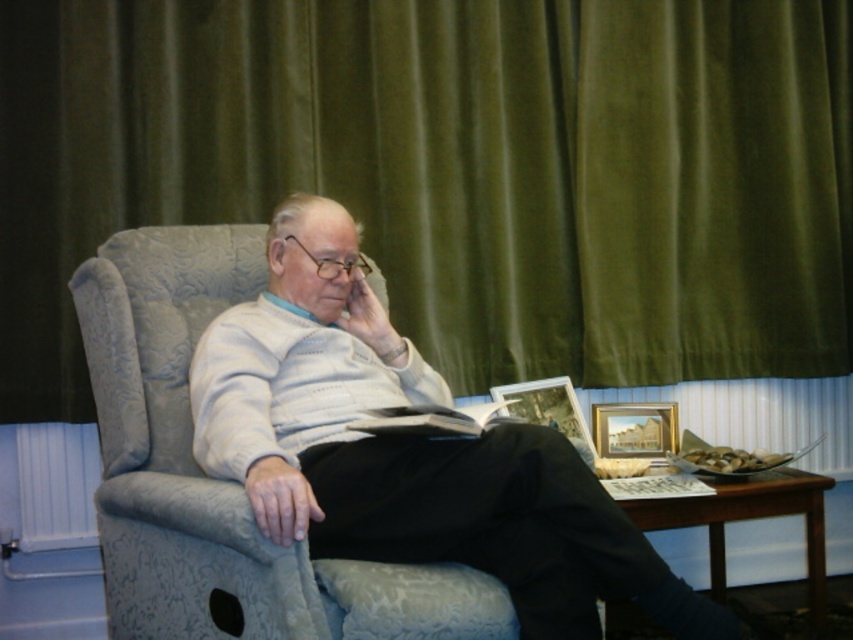
Between velvet green curtain at upper center and gold-framed picture at right, which one has more height?

velvet green curtain at upper center is taller.

Does velvet green curtain at upper center have a greater height compared to gold-framed picture at right?

Indeed, velvet green curtain at upper center has a greater height compared to gold-framed picture at right.

Find the location of a particular element. The height and width of the screenshot is (640, 853). velvet green curtain at upper center is located at coordinates (454, 172).

In order to click on velvet green curtain at upper center in this screenshot , I will do `click(454, 172)`.

Is light gray fabric chair at center shorter than gold-framed picture at right?

Incorrect, light gray fabric chair at center's height does not fall short of gold-framed picture at right's.

Does light gray fabric chair at center have a greater width compared to gold-framed picture at right?

Yes, light gray fabric chair at center is wider than gold-framed picture at right.

Where is `light gray fabric chair at center`? The image size is (853, 640). light gray fabric chair at center is located at coordinates (405, 451).

What do you see at coordinates (635, 429) in the screenshot? I see `gold-framed picture at right` at bounding box center [635, 429].

Does point (607, 406) come closer to viewer compared to point (502, 397)?

No, (607, 406) is further to viewer.

Between point (646, 410) and point (552, 406), which one is positioned in front?

Point (552, 406) is in front.

Where is `gold-framed picture at right`? The height and width of the screenshot is (640, 853). gold-framed picture at right is located at coordinates (635, 429).